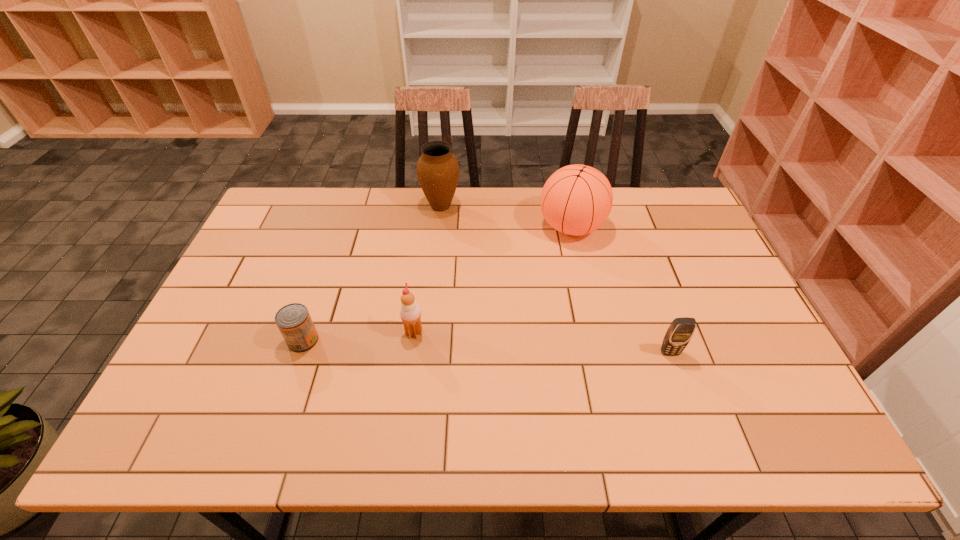
Identify which object is located as the second nearest to the icecream. Please provide its 2D coordinates. Your answer should be formatted as a tuple, i.e. [(x, y)], where the tuple contains the x and y coordinates of a point satisfying the conditions above.

[(576, 200)]

At what (x,y) coordinates should I click in order to perform the action: click on object that stands as the third closest to the fourth object from left to right. Please return your answer as a coordinate pair (x, y). Image resolution: width=960 pixels, height=540 pixels. Looking at the image, I should click on (410, 312).

The image size is (960, 540). What are the coordinates of `vacant space that satisfies the following two spatial constraints: 1. on the back side of the leftmost object; 2. on the right side of the urn` in the screenshot? It's located at (348, 206).